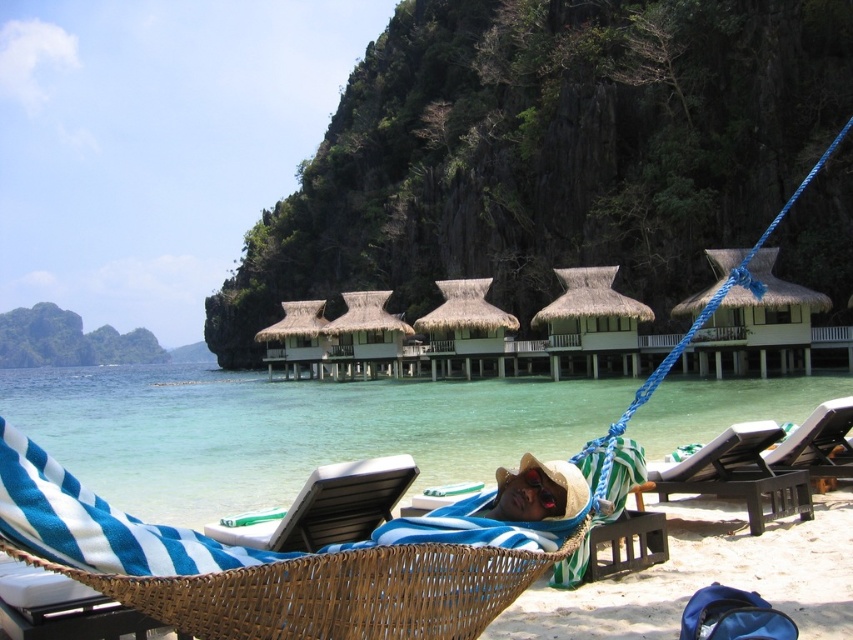
Between white thatch hut at center and black plastic beach chair at lower center, which one is positioned higher?

white thatch hut at center is above.

Where is `white thatch hut at center`? white thatch hut at center is located at coordinates (761, 317).

Locate an element on the screen. The image size is (853, 640). white thatch hut at center is located at coordinates (761, 317).

Is blue striped fabric at center below thatched roof huts at center?

Indeed, blue striped fabric at center is positioned under thatched roof huts at center.

Between blue striped fabric at center and thatched roof huts at center, which one is positioned higher?

thatched roof huts at center

Is point (149, 525) positioned before point (440, 365)?

Yes, point (149, 525) is in front of point (440, 365).

Locate an element on the screen. The image size is (853, 640). blue striped fabric at center is located at coordinates (274, 564).

Does thatched roof huts at center have a lesser width compared to dark brown wooden beach chair at lower right?

No.

How far apart are thatched roof huts at center and dark brown wooden beach chair at lower right?

They are 47.07 meters apart.

Locate an element on the screen. thatched roof huts at center is located at coordinates (468, 333).